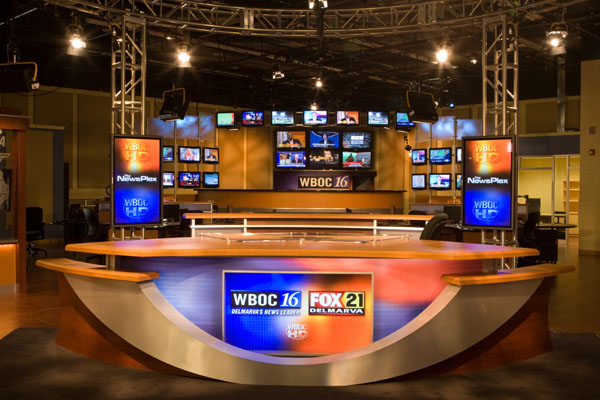
Locate an element on the screen. Image resolution: width=600 pixels, height=400 pixels. panel is located at coordinates (64, 113), (103, 147), (540, 115), (465, 113), (225, 168), (247, 177), (385, 169).